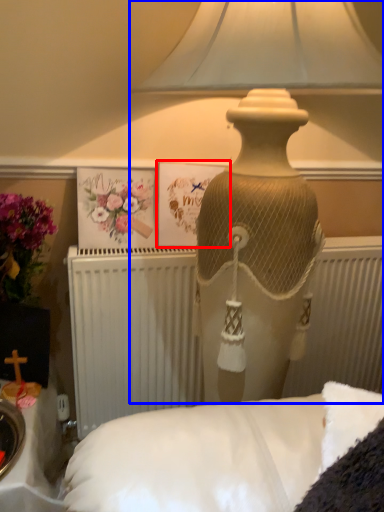
Question: Which object is closer to the camera taking this photo, postcard (highlighted by a red box) or lamp (highlighted by a blue box)?

Choices:
 (A) postcard
 (B) lamp

Answer: (B)